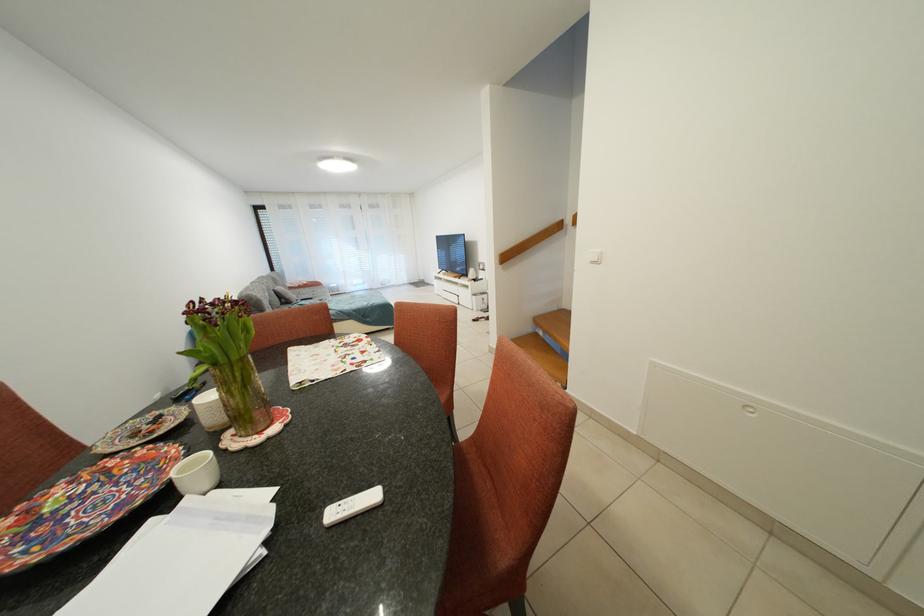
Where would you sit the orange chair sitting surface? Please return your answer as a coordinate pair (x, y).

(466, 514)